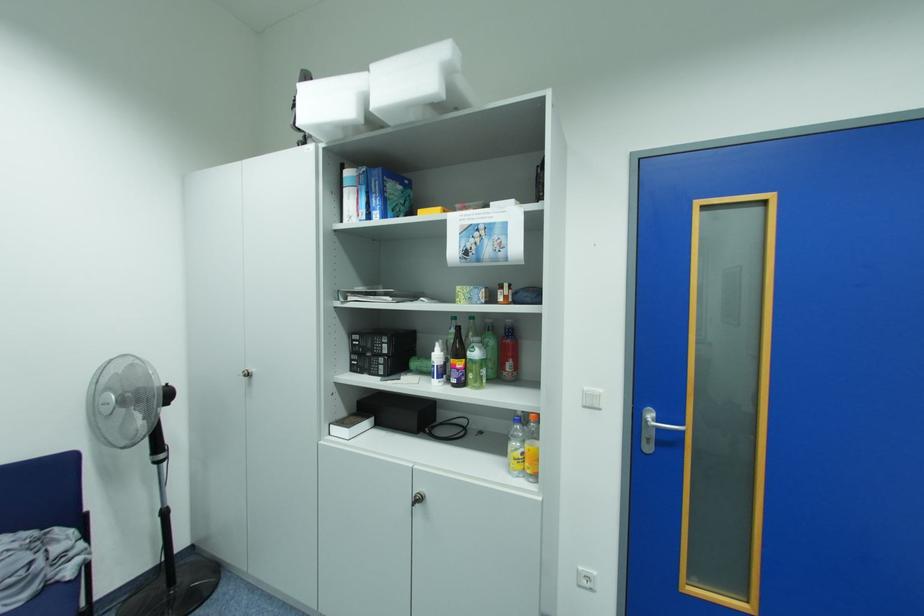
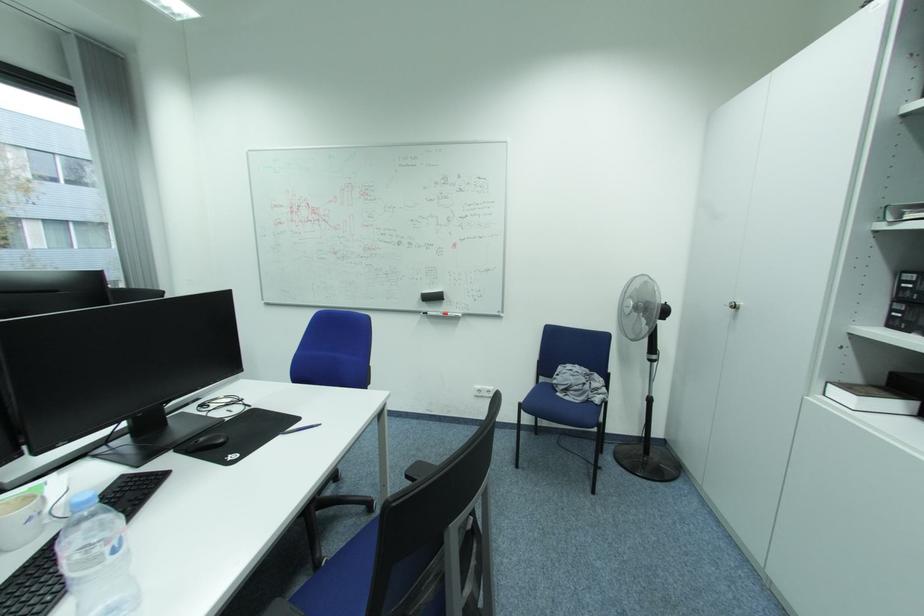
Question: The first image is from the beginning of the video and the second image is from the end. How did the camera likely rotate when shooting the video?

Choices:
 (A) Left
 (B) Right
 (C) Up
 (D) Down

Answer: (A)